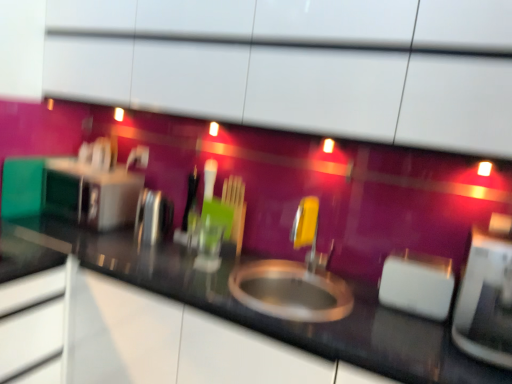
Image resolution: width=512 pixels, height=384 pixels. I want to click on vacant area that lies in front of white plastic toaster at right, arranged as the 2th appliance when viewed from the front, so click(414, 329).